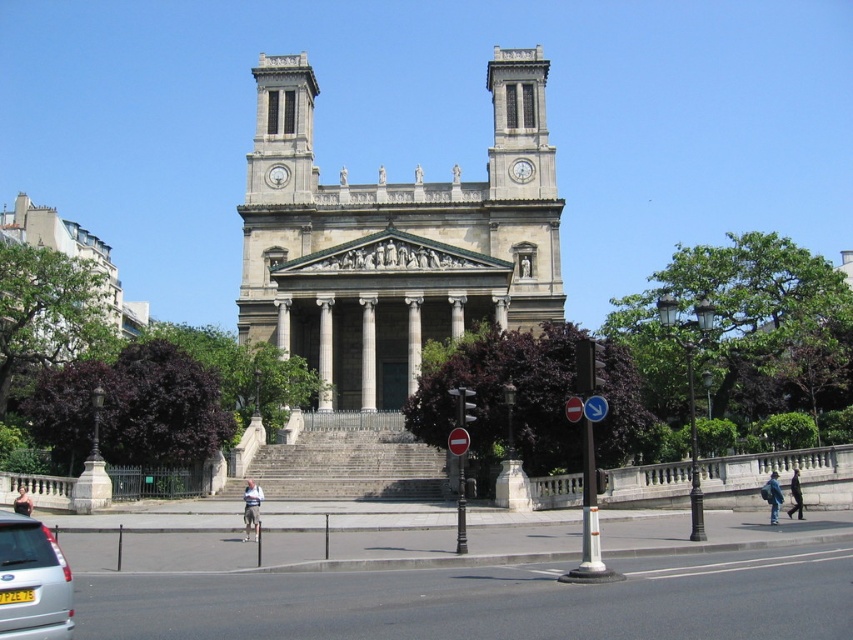
You are a photographer planning to capture the white stone church at center and the silver metallic car at lower left in a single frame. Based on their sizes, which object should you focus on to ensure both are visible without cropping?

The white stone church at center is wider than the silver metallic car at lower left, so focusing on the church will ensure both are visible in the frame since it occupies more space.

You are an architect planning to add a new sculpture to the white stone church at center and the white marble column at center. Which structure allows for a taller sculpture due to its height?

The white stone church at center is much taller than the white marble column at center, so the sculpture can be placed on the white stone church at center to accommodate a taller design.